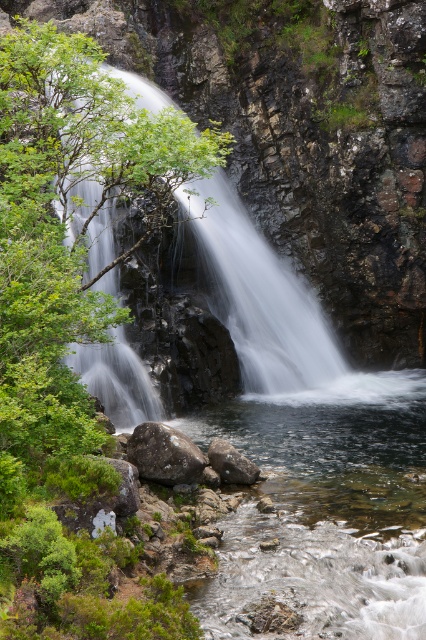
Looking at this image, can you confirm if green leafy tree at center is positioned above green mossy rock at upper left?

Indeed, green leafy tree at center is positioned over green mossy rock at upper left.

Does green leafy tree at center appear on the left side of green mossy rock at upper left?

Incorrect, green leafy tree at center is not on the left side of green mossy rock at upper left.

Between point (94, 307) and point (285, 374), which one is positioned in front?

Point (94, 307) is in front.

Identify the location of green leafy tree at center. The width and height of the screenshot is (426, 640). (69, 320).

Who is higher up, gray rough rock at lower center or gray rock at center?

Positioned higher is gray rough rock at lower center.

Does gray rough rock at lower center have a smaller size compared to gray rock at center?

No, gray rough rock at lower center is not smaller than gray rock at center.

Which is behind, point (187, 464) or point (230, 481)?

The point (230, 481) is behind.

Find the location of a particular element. gray rough rock at lower center is located at coordinates (164, 454).

Can you confirm if green leafy tree at center is positioned to the right of gray rock at center?

In fact, green leafy tree at center is to the left of gray rock at center.

Is point (95, 161) less distant than point (230, 460)?

Yes, it is.

Locate an element on the screen. green leafy tree at center is located at coordinates (69, 320).